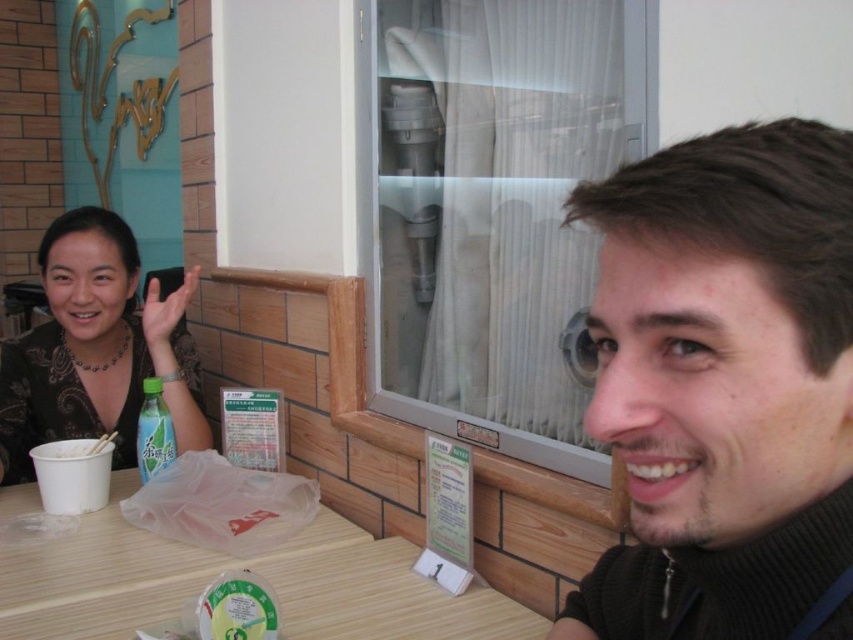
Is green matte bottle at center behind matte black hand at upper left?

No.

Can you confirm if green matte bottle at center is wider than matte black hand at upper left?

No.

Between point (141, 467) and point (143, 284), which one is positioned in front?

Point (141, 467) is in front.

The image size is (853, 640). I want to click on green matte bottle at center, so click(154, 432).

Can you confirm if matte black dress at left is positioned to the left of matte black hand at upper left?

In fact, matte black dress at left is to the right of matte black hand at upper left.

Which of these two, matte black dress at left or matte black hand at upper left, stands taller?

matte black dress at left

Is point (169, 392) more distant than point (172, 330)?

No, (169, 392) is in front of (172, 330).

At what (x,y) coordinates should I click in order to perform the action: click on matte black dress at left. Please return your answer as a coordinate pair (x, y). The image size is (853, 640). Looking at the image, I should click on (96, 348).

Looking at this image, does wooden table at lower left have a larger size compared to matte black hand at upper left?

Incorrect, wooden table at lower left is not larger than matte black hand at upper left.

Who is more distant from viewer, (154,592) or (166,278)?

Positioned behind is point (166,278).

Find the location of a particular element. The height and width of the screenshot is (640, 853). wooden table at lower left is located at coordinates (234, 566).